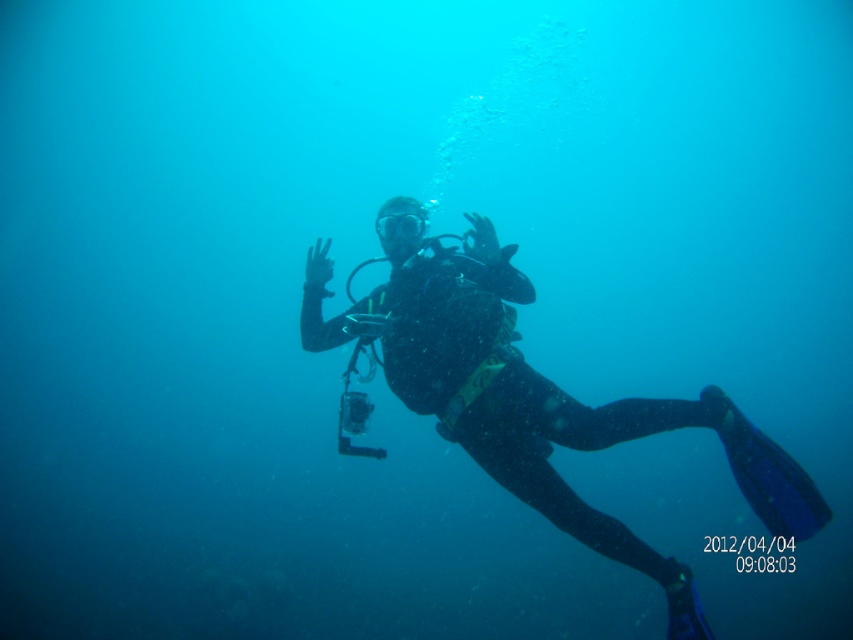
Can you confirm if black matte wetsuit at center is smaller than transparent rubber goggles at center?

No.

Who is more distant from viewer, (646, 428) or (393, 212)?

The point (393, 212) is more distant.

Which is in front, point (399, 321) or point (399, 234)?

Positioned in front is point (399, 321).

At what (x,y) coordinates should I click in order to perform the action: click on black matte wetsuit at center. Please return your answer as a coordinate pair (x, y). This screenshot has height=640, width=853. Looking at the image, I should click on (523, 403).